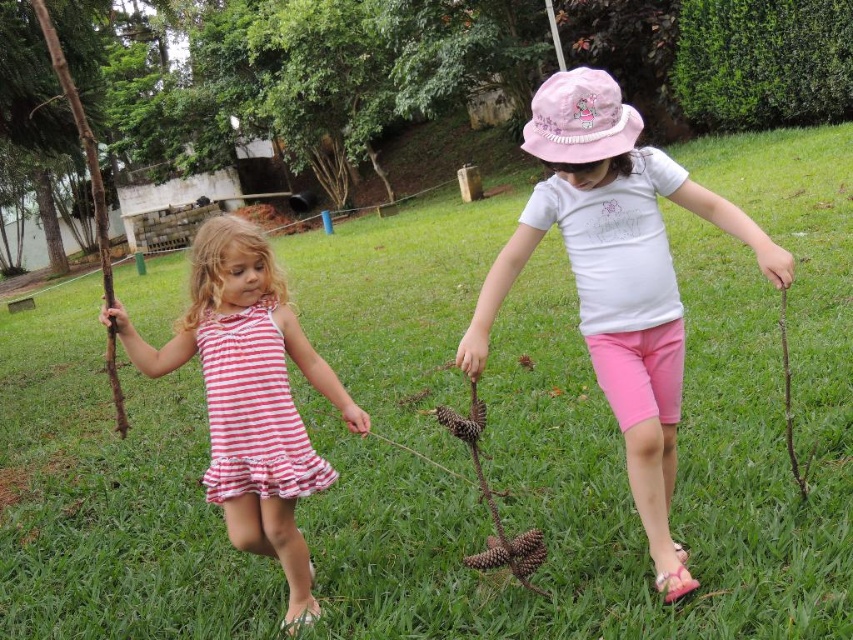
Who is taller, pink striped dress at center or brown rough twig at right?

With more height is brown rough twig at right.

Can you confirm if pink striped dress at center is positioned to the right of brown rough twig at right?

Incorrect, pink striped dress at center is not on the right side of brown rough twig at right.

What do you see at coordinates (253, 412) in the screenshot? This screenshot has width=853, height=640. I see `pink striped dress at center` at bounding box center [253, 412].

Identify the location of pink striped dress at center. (253, 412).

This screenshot has width=853, height=640. I want to click on pink cotton hat at center, so click(x=618, y=276).

Does pink cotton hat at center lie in front of pink striped dress at center?

Yes, it is in front of pink striped dress at center.

The height and width of the screenshot is (640, 853). Find the location of `pink cotton hat at center`. pink cotton hat at center is located at coordinates (618, 276).

Looking at this image, who is more forward, (555, 214) or (274, 356)?

Point (555, 214) is more forward.

Measure the distance between point (601, 140) and camera.

Point (601, 140) and camera are 7.44 feet apart from each other.

I want to click on pink cotton hat at center, so click(618, 276).